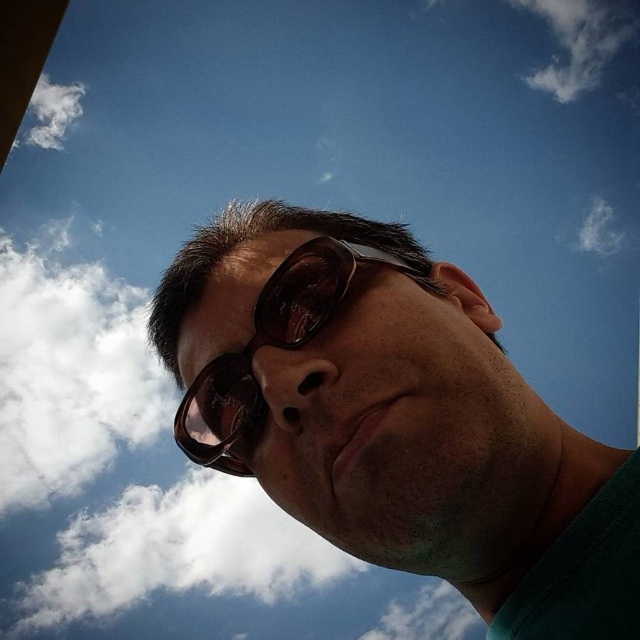
Question: Estimate the real-world distances between objects in this image. Which object is closer to the white fluffy cloud at upper left?

Choices:
 (A) matte black sunglasses at center
 (B) sunglasses at center
 (C) white fluffy cloud at upper right

Answer: (C)

Question: Among these points, which one is farthest from the camera?

Choices:
 (A) (532, 72)
 (B) (595, 452)
 (C) (312, 250)
 (D) (36, 129)

Answer: (A)

Question: In this image, where is matte black sunglasses at center located relative to white fluffy cloud at upper right?

Choices:
 (A) left
 (B) right

Answer: (A)

Question: Does matte black sunglasses at center come behind white fluffy cloud at upper left?

Choices:
 (A) yes
 (B) no

Answer: (B)

Question: Can you confirm if matte black sunglasses at center is wider than white fluffy cloud at upper right?

Choices:
 (A) yes
 (B) no

Answer: (B)

Question: Which object is farther from the camera taking this photo?

Choices:
 (A) sunglasses at center
 (B) white fluffy cloud at upper left
 (C) matte black sunglasses at center
 (D) white fluffy cloud at upper right

Answer: (D)